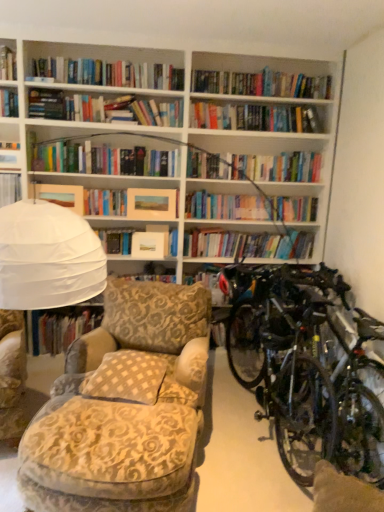
Question: Is matte yellow paper at upper left, which is the 1th paperback book from left to right, completely or partially outside of matte paper picture frame at center, the 1th paperback book in the right-to-left sequence?

Choices:
 (A) no
 (B) yes

Answer: (B)

Question: Could you tell me if matte yellow paper at upper left, arranged as the 3th paperback book when viewed from the right, is facing matte paper picture frame at center, the 1th paperback book in the right-to-left sequence?

Choices:
 (A) no
 (B) yes

Answer: (A)

Question: From the image's perspective, would you say matte yellow paper at upper left, arranged as the 3th paperback book when viewed from the right, is shown under matte paper picture frame at center, the 1th paperback book in the right-to-left sequence?

Choices:
 (A) yes
 (B) no

Answer: (B)

Question: Can you confirm if matte yellow paper at upper left, which is the 1th paperback book from left to right, is smaller than matte paper picture frame at center, which is the 3th paperback book in left-to-right order?

Choices:
 (A) no
 (B) yes

Answer: (B)

Question: Is the depth of matte yellow paper at upper left, arranged as the 3th paperback book when viewed from the right, greater than that of matte paper picture frame at center, which is the 3th paperback book in left-to-right order?

Choices:
 (A) yes
 (B) no

Answer: (B)

Question: Is hardcover book at upper left, arranged as the second book when viewed from the back, to the left or to the right of shiny metallic bicycles at right in the image?

Choices:
 (A) left
 (B) right

Answer: (A)

Question: In terms of width, does hardcover book at upper left, which is counted as the 1th book, starting from the left, look wider or thinner when compared to shiny metallic bicycles at right?

Choices:
 (A) thin
 (B) wide

Answer: (A)

Question: From the image's perspective, is hardcover book at upper left, the 2th book when ordered from right to left, positioned above or below shiny metallic bicycles at right?

Choices:
 (A) below
 (B) above

Answer: (B)

Question: Is hardcover book at upper left, which is counted as the 1th book, starting from the left, in front of or behind shiny metallic bicycles at right in the image?

Choices:
 (A) front
 (B) behind

Answer: (B)

Question: Is matte paper book at center, positioned as the 2th paperback book in right-to-left order, wider or thinner than shiny metallic bicycles at right?

Choices:
 (A) thin
 (B) wide

Answer: (A)

Question: Relative to shiny metallic bicycles at right, is matte paper book at center, positioned as the 2th paperback book in right-to-left order, in front or behind?

Choices:
 (A) front
 (B) behind

Answer: (B)

Question: Considering the positions of matte paper book at center, marked as the second paperback book in a left-to-right arrangement, and shiny metallic bicycles at right in the image, is matte paper book at center, marked as the second paperback book in a left-to-right arrangement, bigger or smaller than shiny metallic bicycles at right?

Choices:
 (A) small
 (B) big

Answer: (A)

Question: Is matte paper book at center, marked as the second paperback book in a left-to-right arrangement, taller or shorter than shiny metallic bicycles at right?

Choices:
 (A) tall
 (B) short

Answer: (B)

Question: From a real-world perspective, relative to matte paper book at center, marked as the second paperback book in a left-to-right arrangement, is hardcover book at center, the 1th book positioned from the back, vertically above or below?

Choices:
 (A) above
 (B) below

Answer: (B)

Question: Does point (59, 327) appear closer or farther from the camera than point (150, 244)?

Choices:
 (A) closer
 (B) farther

Answer: (B)